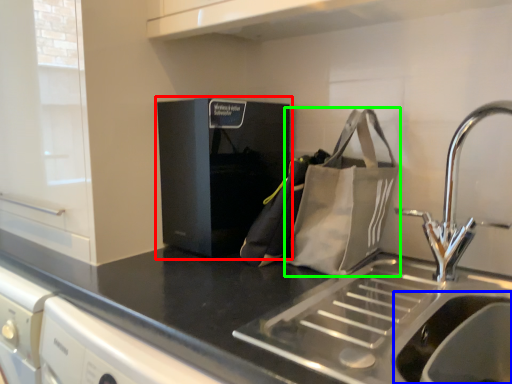
Question: Which object is the farthest from home appliance (highlighted by a red box)? Choose among these: sink (highlighted by a blue box) or pouch (highlighted by a green box).

Choices:
 (A) sink
 (B) pouch

Answer: (A)